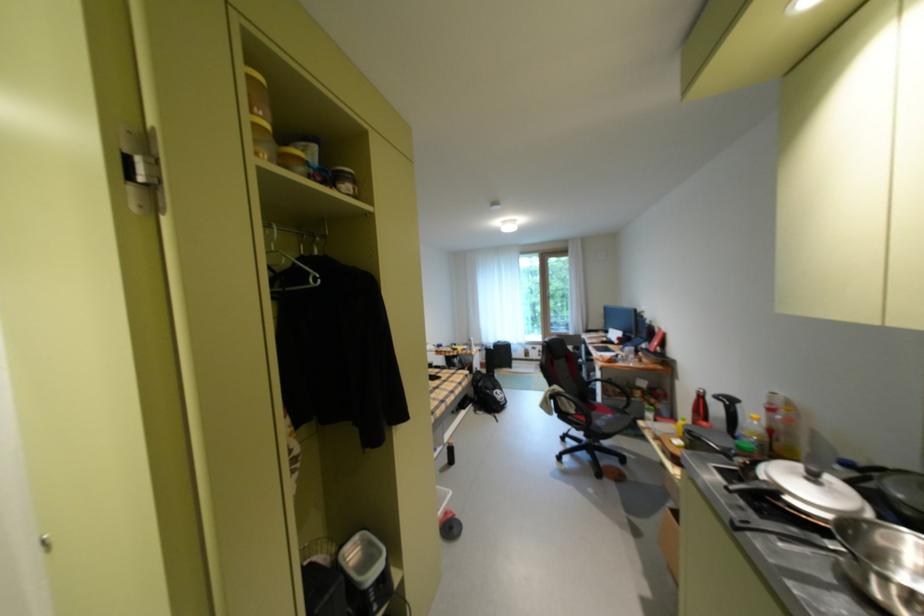
Locate an element on the screen. black kettle handle is located at coordinates (728, 408).